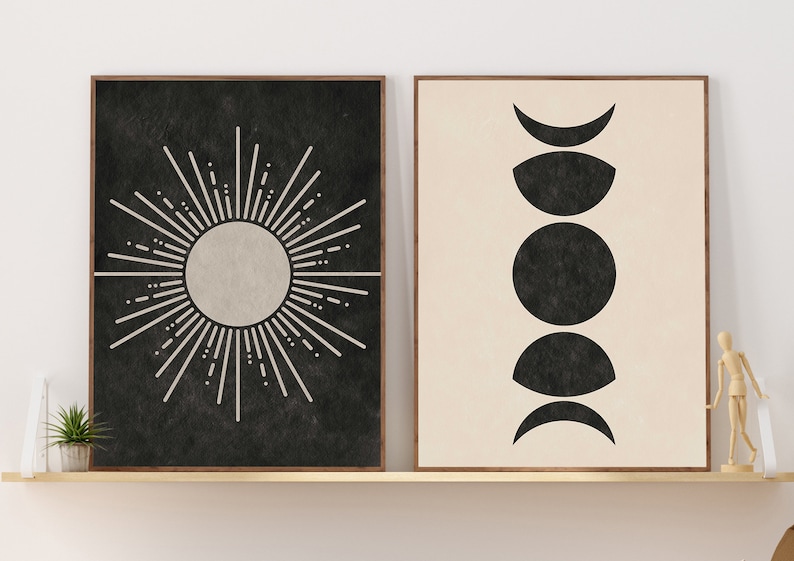
This screenshot has height=561, width=794. Identify the location of wall. (55, 172).